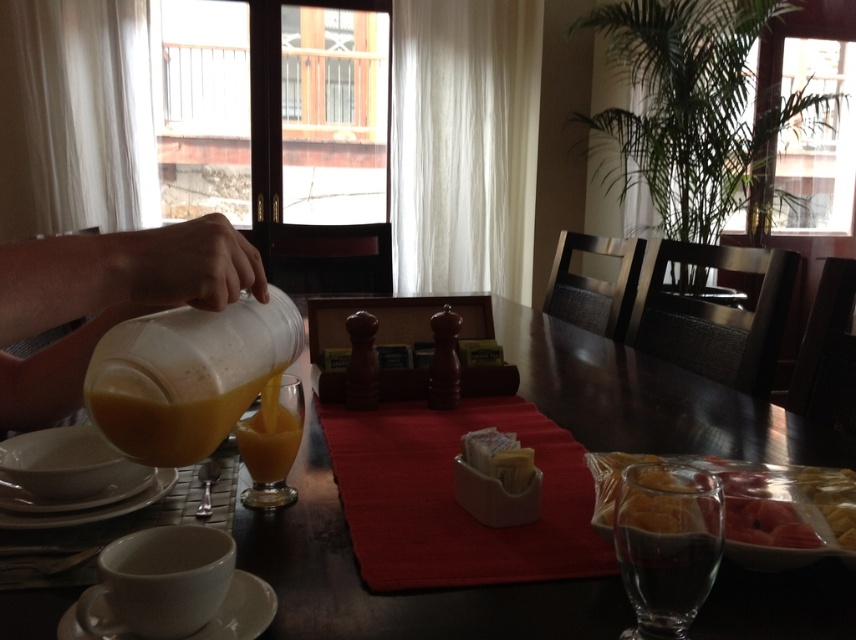
Question: Does translucent glass beverage at upper left appear on the right side of white matte plate at lower left?

Choices:
 (A) no
 (B) yes

Answer: (B)

Question: Observing the image, what is the correct spatial positioning of translucent glass beverage at upper left in reference to white matte plate at lower left?

Choices:
 (A) left
 (B) right

Answer: (B)

Question: Can you confirm if translucent plastic bag at lower right is positioned to the right of white matte plate at lower left?

Choices:
 (A) yes
 (B) no

Answer: (A)

Question: Which point is closer to the camera?

Choices:
 (A) white ceramic plate at lower left
 (B) white matte plate at lower left
 (C) translucent glass at center

Answer: (A)

Question: Which point is closer to the camera taking this photo?

Choices:
 (A) (150, 308)
 (B) (266, 442)
 (C) (128, 486)

Answer: (A)

Question: Among these points, which one is farthest from the camera?

Choices:
 (A) (242, 579)
 (B) (727, 608)
 (C) (488, 456)
 (D) (177, 452)

Answer: (C)